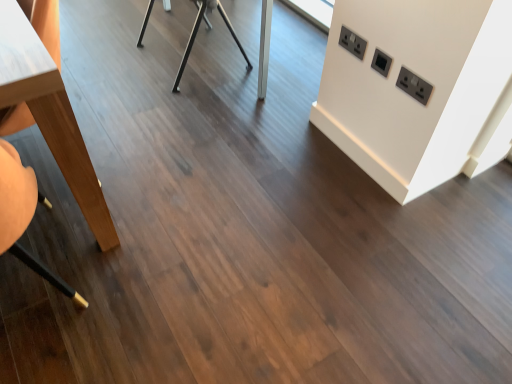
This screenshot has width=512, height=384. In order to click on vacant location below metallic silver table at center, the 2th table positioned from the front (from a real-world perspective) in this screenshot , I will do `click(200, 54)`.